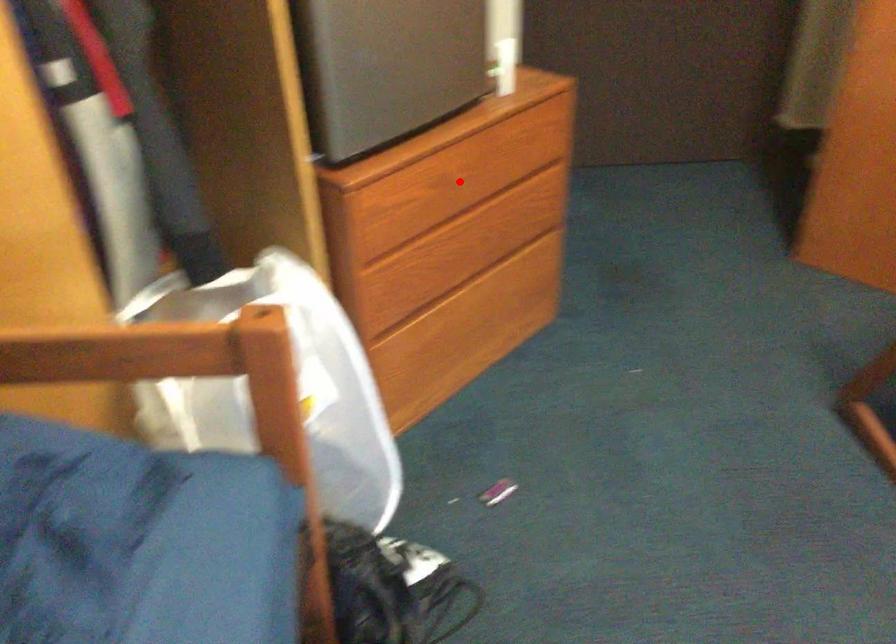
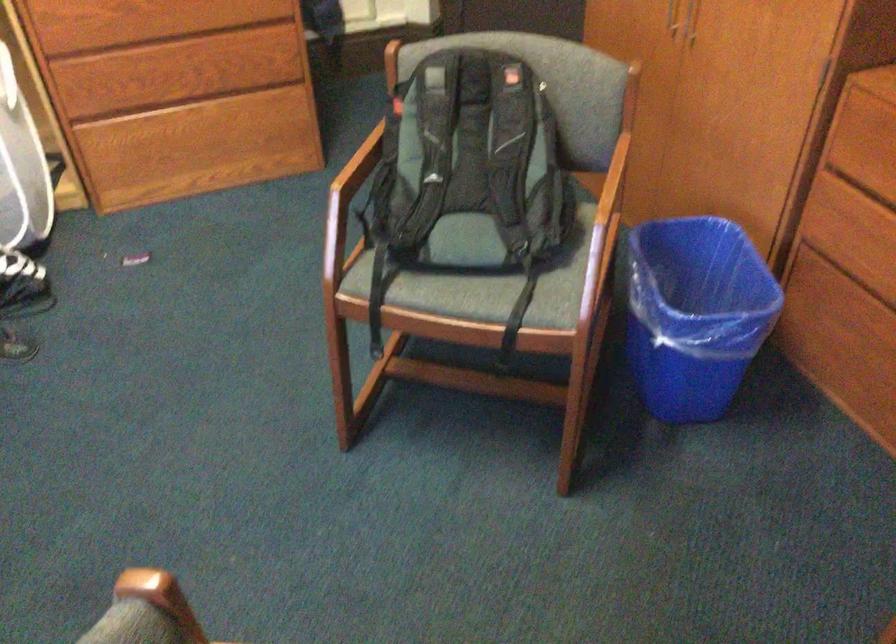
Question: I am providing you with two images of the same scene from different viewpoints. In image1, a red point is highlighted. Considering the same 3D point in image2, which of the following is correct?

Choices:
 (A) It is closer
 (B) It is farther

Answer: (B)